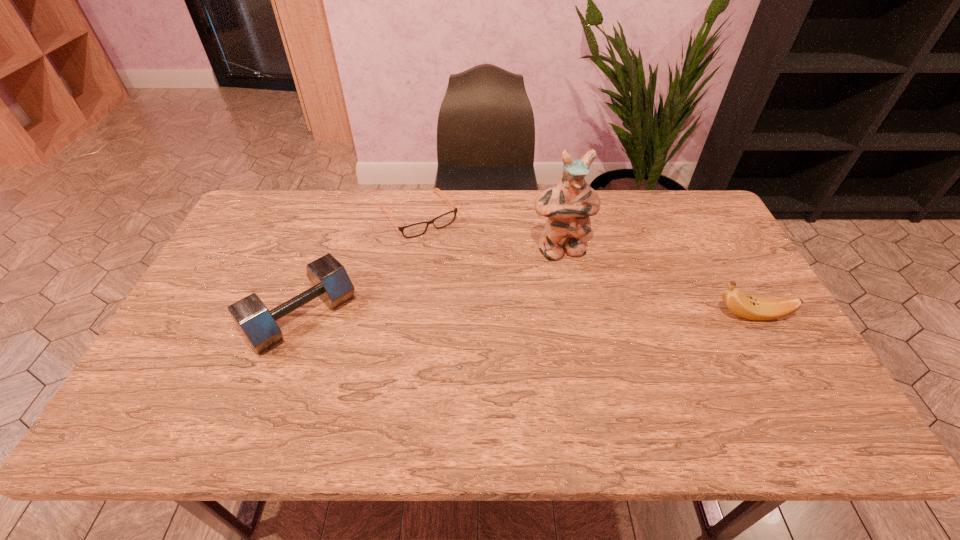
Identify the location of free spot between the spectacles and the dumbbell. (360, 266).

In order to click on object identified as the closest to the dumbbell in this screenshot , I will do 417,229.

Locate an element on the screen. This screenshot has width=960, height=540. object that is the third closest to the shortest object is located at coordinates (754, 308).

The image size is (960, 540). I want to click on vacant space that satisfies the following two spatial constraints: 1. on the back side of the dumbbell; 2. on the left side of the spectacles, so click(x=339, y=215).

Locate an element on the screen. This screenshot has height=540, width=960. free spot that satisfies the following two spatial constraints: 1. on the back side of the dumbbell; 2. on the left side of the rightmost object is located at coordinates (302, 315).

Locate an element on the screen. The image size is (960, 540). vacant point that satisfies the following two spatial constraints: 1. on the back side of the banana; 2. on the right side of the dumbbell is located at coordinates (302, 315).

Where is `vacant area that satisfies the following two spatial constraints: 1. on the back side of the dumbbell; 2. on the left side of the spectacles`? vacant area that satisfies the following two spatial constraints: 1. on the back side of the dumbbell; 2. on the left side of the spectacles is located at coordinates (339, 215).

This screenshot has height=540, width=960. What are the coordinates of `free space that satisfies the following two spatial constraints: 1. on the back side of the rightmost object; 2. on the right side of the dumbbell` in the screenshot? It's located at (302, 315).